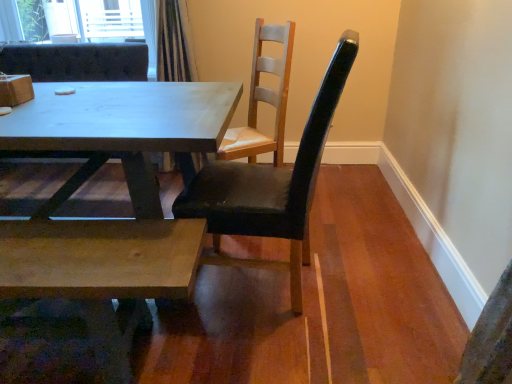
Locate an element on the screen. free point to the right of black leather chair at center, the first chair viewed from the right is located at coordinates (383, 294).